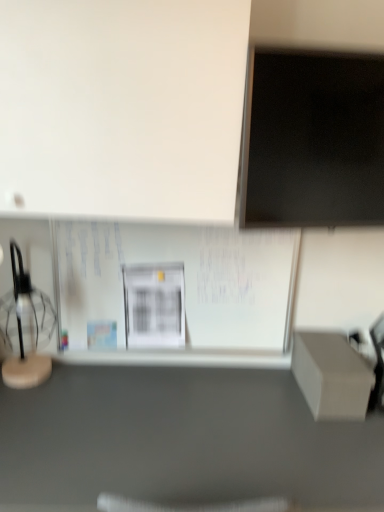
Question: Can you confirm if black matte computer monitor at upper right is thinner than matte gray box at lower right?

Choices:
 (A) yes
 (B) no

Answer: (A)

Question: Does black matte computer monitor at upper right have a smaller size compared to matte gray box at lower right?

Choices:
 (A) no
 (B) yes

Answer: (B)

Question: Is black matte computer monitor at upper right positioned behind matte gray box at lower right?

Choices:
 (A) yes
 (B) no

Answer: (A)

Question: Is matte gray box at lower right at the back of black matte computer monitor at upper right?

Choices:
 (A) yes
 (B) no

Answer: (B)

Question: Can you see black matte computer monitor at upper right touching matte gray box at lower right?

Choices:
 (A) no
 (B) yes

Answer: (A)

Question: From their relative heights in the image, would you say white paperboard at center is taller or shorter than matte gray box at lower right?

Choices:
 (A) tall
 (B) short

Answer: (B)

Question: From a real-world perspective, relative to matte gray box at lower right, is white paperboard at center vertically above or below?

Choices:
 (A) below
 (B) above

Answer: (B)

Question: Is white paperboard at center wider or thinner than matte gray box at lower right?

Choices:
 (A) thin
 (B) wide

Answer: (A)

Question: Does point (228, 317) appear closer or farther from the camera than point (379, 499)?

Choices:
 (A) closer
 (B) farther

Answer: (B)

Question: From a real-world perspective, is translucent glass table lamp at left above or below black matte computer monitor at upper right?

Choices:
 (A) below
 (B) above

Answer: (A)

Question: In the image, is translucent glass table lamp at left positioned in front of or behind black matte computer monitor at upper right?

Choices:
 (A) behind
 (B) front

Answer: (A)

Question: Which is correct: translucent glass table lamp at left is inside black matte computer monitor at upper right, or outside of it?

Choices:
 (A) outside
 (B) inside

Answer: (A)

Question: Does point (34, 309) appear closer or farther from the camera than point (339, 164)?

Choices:
 (A) farther
 (B) closer

Answer: (A)

Question: Which is correct: matte gray box at lower right is inside white paperboard at center, or outside of it?

Choices:
 (A) outside
 (B) inside

Answer: (A)

Question: From a real-world perspective, is matte gray box at lower right physically located above or below white paperboard at center?

Choices:
 (A) above
 (B) below

Answer: (B)